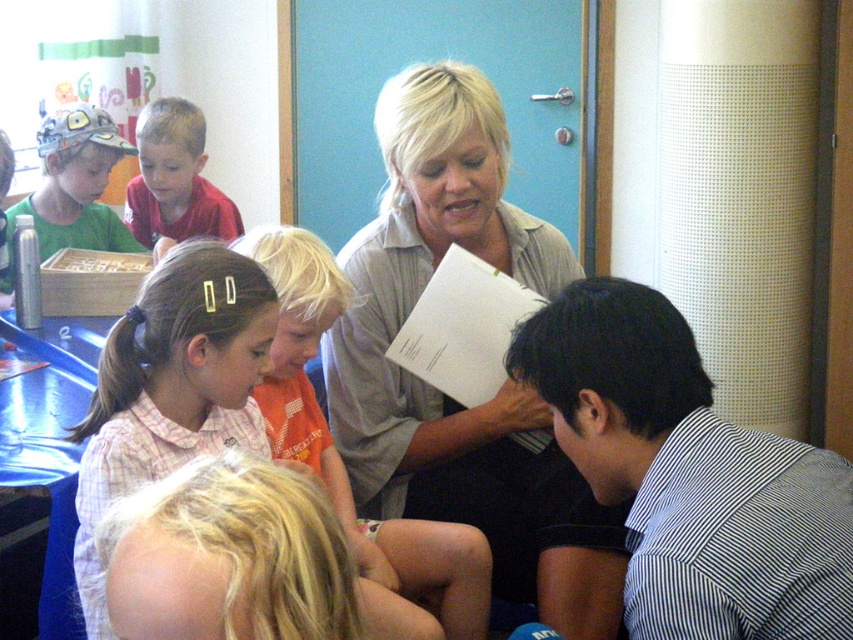
In the classroom scene, there are two children wearing a black striped shirt at lower right and a matte red shirt at upper left. Which child is sitting closer to the front of the classroom?

The black striped shirt at lower right is positioned under the matte red shirt at upper left, meaning it is closer to the front of the classroom.

You are a teacher in the classroom and you need to hand out a small prize to the tallest child between the black striped shirt at lower right and the orange cotton shirt at center. Which child should you give it to?

The orange cotton shirt at center is taller than the black striped shirt at lower right, so you should give the prize to the child wearing the orange cotton shirt at center.